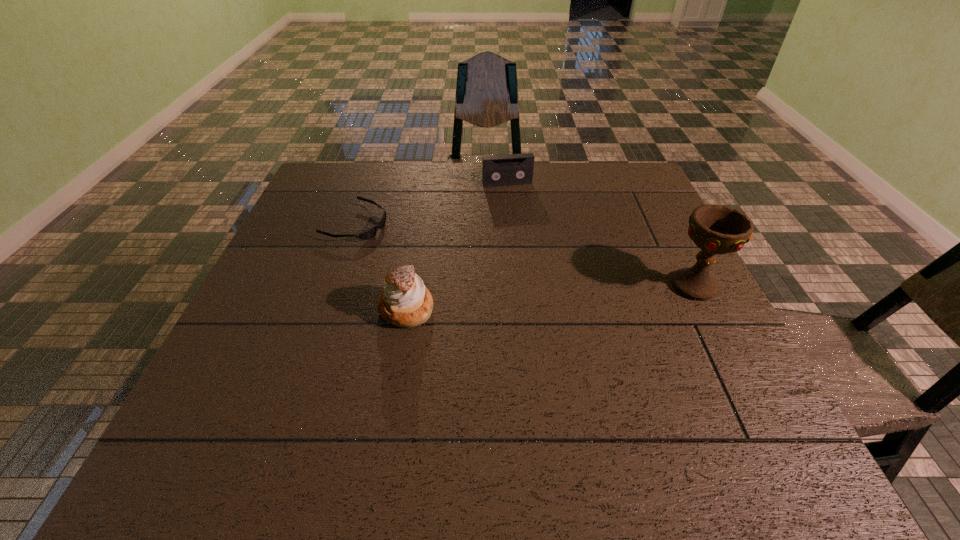
Identify the location of vacant space that satisfies the following two spatial constraints: 1. on the front side of the videotape; 2. on the right side of the rightmost object. The width and height of the screenshot is (960, 540). (516, 286).